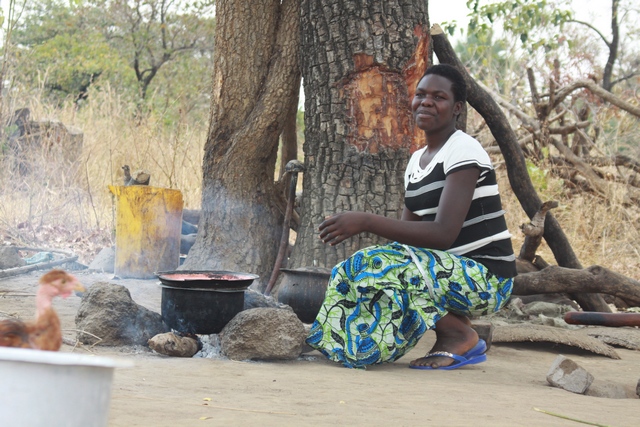
This screenshot has width=640, height=427. In order to click on white bucket in this screenshot , I will do `click(20, 383)`.